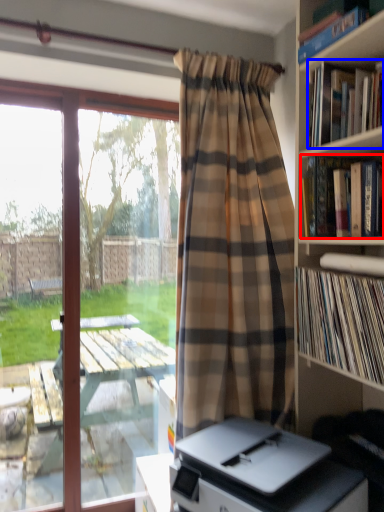
Question: Which object appears farthest to the camera in this image, book (highlighted by a red box) or book (highlighted by a blue box)?

Choices:
 (A) book
 (B) book

Answer: (A)